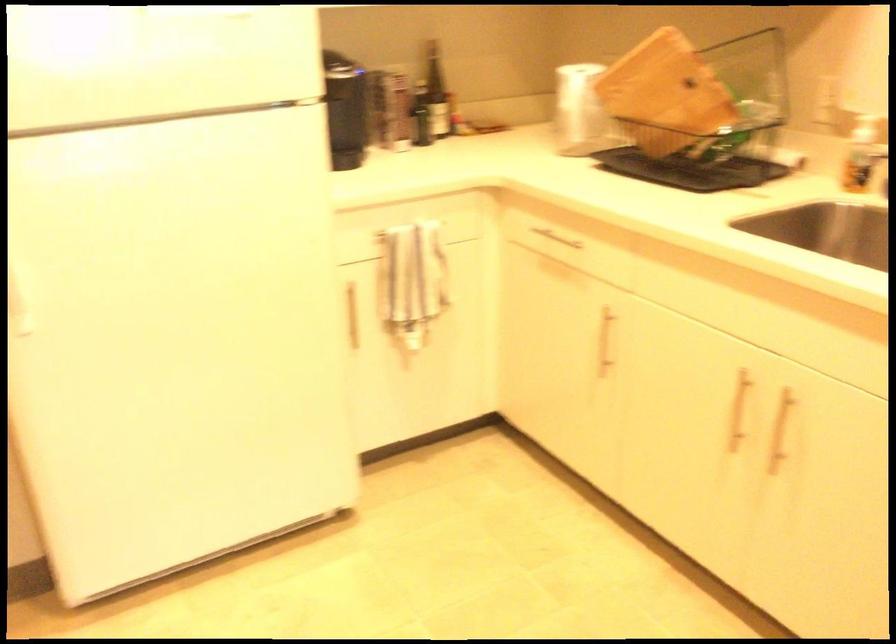
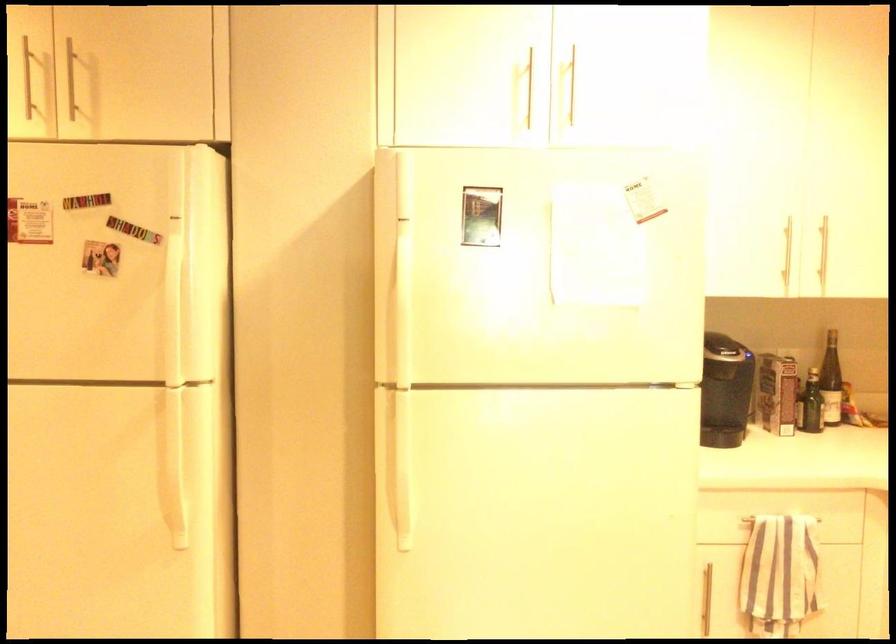
Locate, in the second image, the point that corresponds to the point at 389,108 in the first image.

(777, 393)